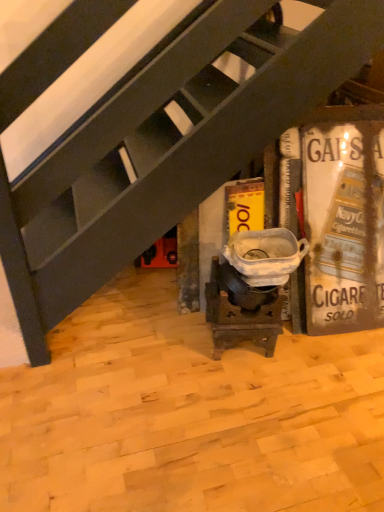
Locate an element on the screen. Image resolution: width=384 pixels, height=512 pixels. metallic vintage sign at right is located at coordinates (341, 223).

The image size is (384, 512). Describe the element at coordinates (341, 223) in the screenshot. I see `metallic vintage sign at right` at that location.

The height and width of the screenshot is (512, 384). I want to click on metallic vintage sign at right, so click(x=341, y=223).